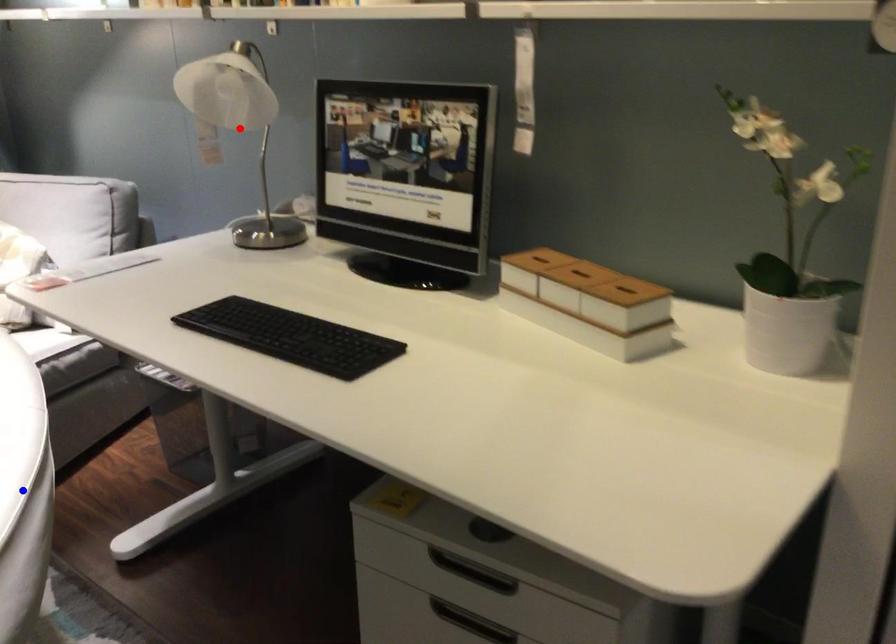
Question: Which of the two points in the image is closer to the camera?

Choices:
 (A) Blue point is closer.
 (B) Red point is closer.

Answer: (A)